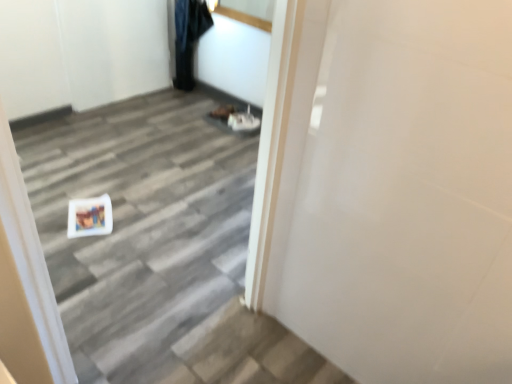
Find the location of `free region on the left part of denim pants at upper center`. free region on the left part of denim pants at upper center is located at coordinates (167, 99).